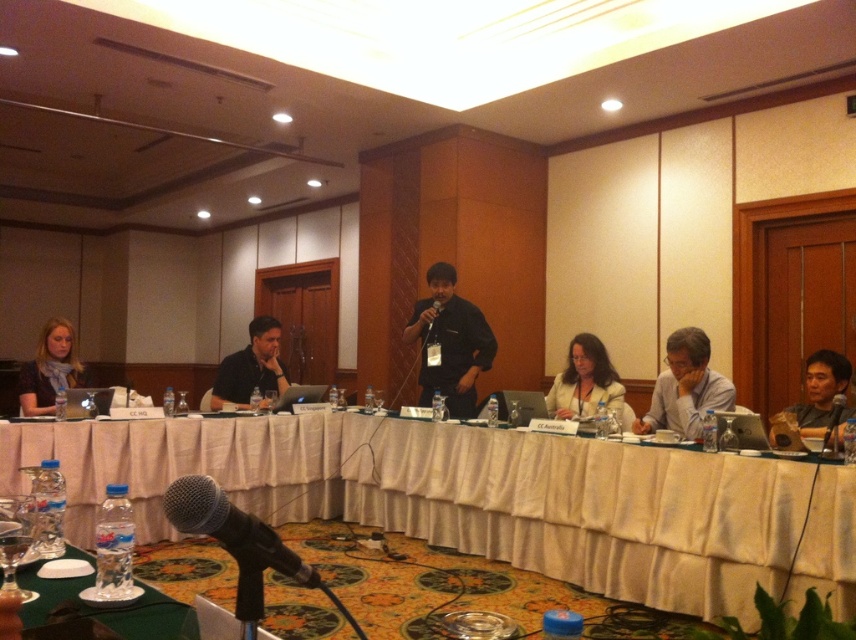
Which of these two, gray fabric shirt at right or matte black scarf at left, stands shorter?

Standing shorter between the two is matte black scarf at left.

Is gray fabric shirt at right taller than matte black scarf at left?

Correct, gray fabric shirt at right is much taller as matte black scarf at left.

What do you see at coordinates (685, 387) in the screenshot? This screenshot has width=856, height=640. I see `gray fabric shirt at right` at bounding box center [685, 387].

Image resolution: width=856 pixels, height=640 pixels. I want to click on gray fabric shirt at right, so click(685, 387).

Based on the photo, between green fabric table at center and matte black laptop at right, which one is positioned higher?

Positioned higher is matte black laptop at right.

Between green fabric table at center and matte black laptop at right, which one is positioned lower?

green fabric table at center is below.

Is point (782, 508) positioned behind point (815, 362)?

No, (782, 508) is closer to viewer.

At what (x,y) coordinates should I click in order to perform the action: click on green fabric table at center. Please return your answer as a coordinate pair (x, y). The image size is (856, 640). Looking at the image, I should click on (461, 493).

Can you confirm if green fabric table at center is positioned above black matte microphone at center?

No.

Which is more to the left, green fabric table at center or black matte microphone at center?

green fabric table at center

This screenshot has height=640, width=856. I want to click on green fabric table at center, so (x=461, y=493).

Where is `green fabric table at center`? This screenshot has height=640, width=856. green fabric table at center is located at coordinates (461, 493).